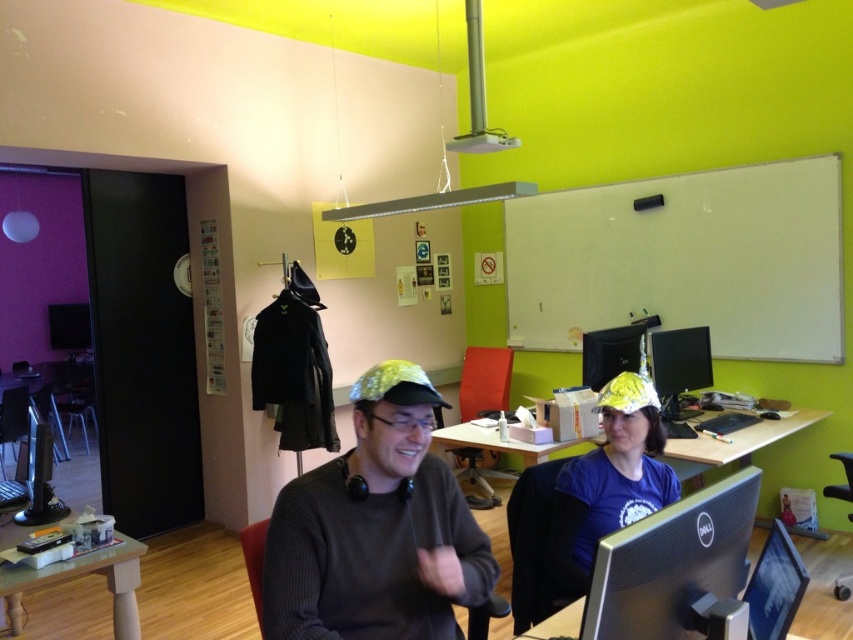
Who is more forward, [440,616] or [788,426]?

Point [440,616] is more forward.

Does matte gold cap at center have a lesser width compared to wooden desk at center?

Indeed, matte gold cap at center has a lesser width compared to wooden desk at center.

Does point (374, 468) lie in front of point (759, 428)?

That is True.

Identify the location of matte gold cap at center. This screenshot has width=853, height=640. (376, 529).

Between black glossy monitor at center and black plastic laptop at left, which one has less height?

black plastic laptop at left

Can you confirm if black glossy monitor at center is positioned below black plastic laptop at left?

No.

What do you see at coordinates (672, 563) in the screenshot? I see `black glossy monitor at center` at bounding box center [672, 563].

The image size is (853, 640). I want to click on black glossy monitor at center, so click(x=672, y=563).

Is black glossy monitor at center in front of blue fabric hat at center?

Yes.

Looking at this image, which of these two, black glossy monitor at center or blue fabric hat at center, stands shorter?

With less height is black glossy monitor at center.

Which is behind, point (619, 541) or point (614, 417)?

Point (614, 417)

I want to click on black glossy monitor at center, so (x=672, y=563).